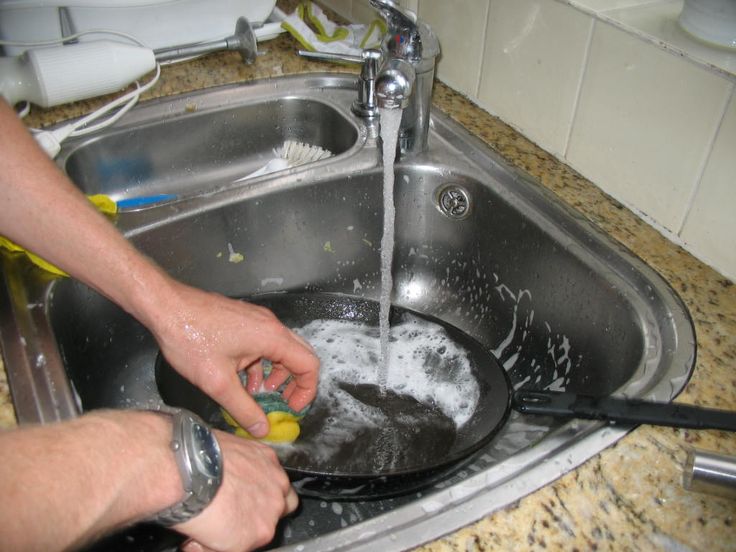
Find the location of a particular element. electric cord is located at coordinates (59, 135).